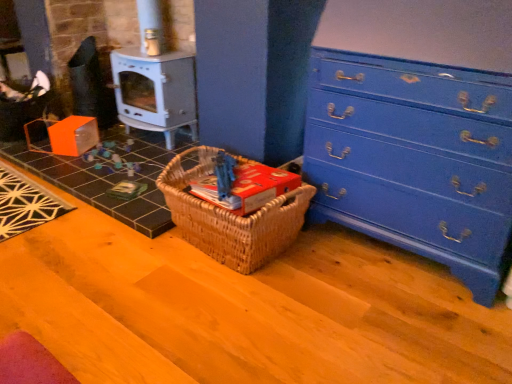
Locate an element on the screen. This screenshot has width=512, height=384. woven wood picnic basket at center is located at coordinates (231, 217).

Identify the location of orange cardboard box at lower left. (110, 175).

Between point (284, 166) and point (103, 134), which one is positioned in front?

Positioned in front is point (284, 166).

Is woven wood picnic basket at center in front of or behind orange cardboard box at lower left in the image?

In the image, woven wood picnic basket at center appears in front of orange cardboard box at lower left.

Consider the image. Is red cardboard book at center further to camera compared to blue painted wood chest of drawers at right?

Yes, red cardboard book at center is further from the viewer.

Considering the relative sizes of red cardboard book at center and blue painted wood chest of drawers at right in the image provided, is red cardboard book at center thinner than blue painted wood chest of drawers at right?

Indeed, red cardboard book at center has a lesser width compared to blue painted wood chest of drawers at right.

In the scene shown: Is red cardboard book at center positioned far away from blue painted wood chest of drawers at right?

Actually, red cardboard book at center and blue painted wood chest of drawers at right are a little close together.

Considering the sizes of objects metallic gray stove at center left and orange cardboard box at lower left in the image provided, who is wider, metallic gray stove at center left or orange cardboard box at lower left?

With larger width is orange cardboard box at lower left.

Looking at the image, does metallic gray stove at center left seem bigger or smaller compared to orange cardboard box at lower left?

Considering their sizes, metallic gray stove at center left takes up more space than orange cardboard box at lower left.

From the image's perspective, is metallic gray stove at center left above or below orange cardboard box at lower left?

metallic gray stove at center left is situated higher than orange cardboard box at lower left in the image.

Considering the positions of objects blue painted wood chest of drawers at right and metallic gray stove at center left in the image provided, who is in front, blue painted wood chest of drawers at right or metallic gray stove at center left?

blue painted wood chest of drawers at right is closer to the camera.

Which is closer, (502, 173) or (150, 93)?

Point (502, 173)

Considering the sizes of blue painted wood chest of drawers at right and metallic gray stove at center left in the image, is blue painted wood chest of drawers at right taller or shorter than metallic gray stove at center left?

Considering their sizes, blue painted wood chest of drawers at right has more height than metallic gray stove at center left.

From a real-world perspective, who is located higher, blue painted wood chest of drawers at right or metallic gray stove at center left?

In real-world perspective, blue painted wood chest of drawers at right is above.

Which object is more forward, red cardboard book at center or woven wood picnic basket at center?

woven wood picnic basket at center is more forward.

Which object is positioned more to the left, red cardboard book at center or woven wood picnic basket at center?

woven wood picnic basket at center is more to the left.

Is red cardboard book at center taller or shorter than woven wood picnic basket at center?

In the image, red cardboard book at center appears to be shorter than woven wood picnic basket at center.

From a real-world perspective, is red cardboard book at center under woven wood picnic basket at center?

No.

Who is shorter, blue painted wood chest of drawers at right or woven wood picnic basket at center?

woven wood picnic basket at center is shorter.

Is blue painted wood chest of drawers at right in front of woven wood picnic basket at center?

That is True.

From the image's perspective, is blue painted wood chest of drawers at right positioned above or below woven wood picnic basket at center?

Clearly, from the image's perspective, blue painted wood chest of drawers at right is above woven wood picnic basket at center.

Which point is more distant from viewer, [170,65] or [493,195]?

Answer: The point [170,65] is farther.

Which object is positioned more to the left, metallic gray stove at center left or blue painted wood chest of drawers at right?

metallic gray stove at center left is more to the left.

Measure the distance from metallic gray stove at center left to blue painted wood chest of drawers at right.

metallic gray stove at center left and blue painted wood chest of drawers at right are 1.27 meters apart.

The image size is (512, 384). In order to click on the chest of drawers that is below the metallic gray stove at center left (from the image's perspective) in this screenshot , I will do `click(414, 159)`.

At what (x,y) coordinates should I click in order to perform the action: click on tile that is on the left side of woven wood picnic basket at center. Please return your answer as a coordinate pair (x, y). The width and height of the screenshot is (512, 384). Looking at the image, I should click on (110, 175).

Find the location of a particular element. The height and width of the screenshot is (384, 512). book below the blue painted wood chest of drawers at right (from the image's perspective) is located at coordinates (247, 187).

Considering their positions, is woven wood picnic basket at center positioned further to metallic gray stove at center left than orange cardboard box at lower left?

woven wood picnic basket at center is further to metallic gray stove at center left.

Considering their positions, is red cardboard book at center positioned further to metallic gray stove at center left than blue painted wood chest of drawers at right?

blue painted wood chest of drawers at right.

Which object lies further to the anchor point metallic gray stove at center left, red cardboard book at center or woven wood picnic basket at center?

red cardboard book at center lies further to metallic gray stove at center left than the other object.

When comparing their distances from woven wood picnic basket at center, does blue painted wood chest of drawers at right or orange cardboard box at lower left seem closer?

blue painted wood chest of drawers at right.

Estimate the real-world distances between objects in this image. Which object is closer to red cardboard book at center, blue painted wood chest of drawers at right or woven wood picnic basket at center?

woven wood picnic basket at center is closer to red cardboard book at center.

Looking at the image, which one is located closer to blue painted wood chest of drawers at right, woven wood picnic basket at center or orange cardboard box at lower left?

Based on the image, woven wood picnic basket at center appears to be nearer to blue painted wood chest of drawers at right.

Estimate the real-world distances between objects in this image. Which object is further from metallic gray stove at center left, red cardboard book at center or orange cardboard box at lower left?

The object further to metallic gray stove at center left is red cardboard book at center.

Which object lies further to the anchor point orange cardboard box at lower left, red cardboard book at center or blue painted wood chest of drawers at right?

blue painted wood chest of drawers at right is positioned further to the anchor orange cardboard box at lower left.

You are a GUI agent. You are given a task and a screenshot of the screen. Output one action in this format:
    pyautogui.click(x=<x>, y=<y>)
    Task: Click on the appliance situated between orange cardboard box at lower left and red cardboard book at center from left to right
    This screenshot has height=384, width=512.
    Given the screenshot: What is the action you would take?
    pyautogui.click(x=155, y=91)

Locate an element on the screen. book between woven wood picnic basket at center and blue painted wood chest of drawers at right from left to right is located at coordinates (247, 187).

Where is `tile between metallic gray stove at center left and woven wood picnic basket at center in the vertical direction`? This screenshot has height=384, width=512. tile between metallic gray stove at center left and woven wood picnic basket at center in the vertical direction is located at coordinates (110, 175).

This screenshot has width=512, height=384. What are the coordinates of `picnic basket between orange cardboard box at lower left and blue painted wood chest of drawers at right in the horizontal direction` in the screenshot? It's located at (231, 217).